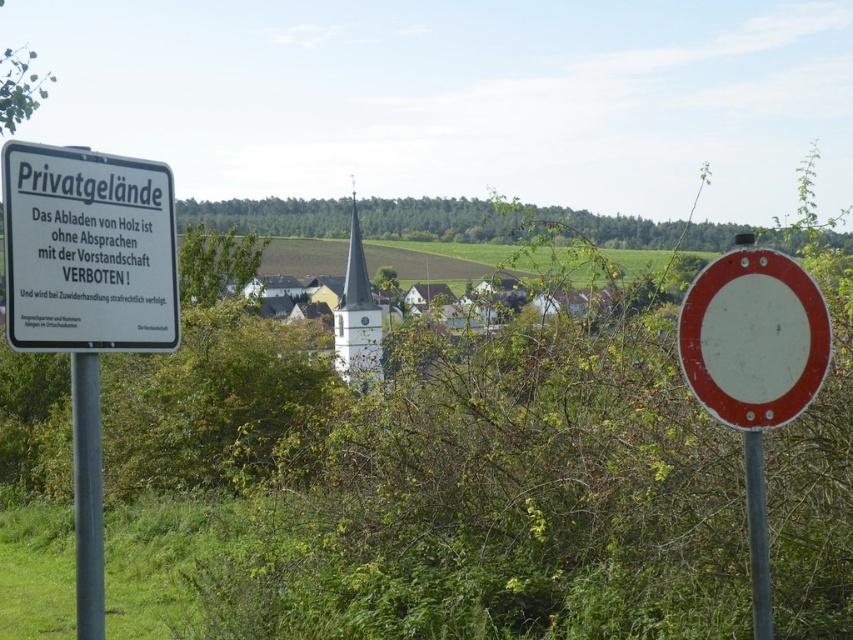
You are a delivery driver approaching the entrance of a property. You see a white plastic sign at upper left and a white matte circle at center. Which object is closer to you as you approach the entrance?

The white plastic sign at upper left is closer to you because it is in front of the white matte circle at center.

Consider the image. You are a delivery driver who needs to unload wood at this location. You see the white plastic sign at upper left and a camera. How far apart are they?

The white plastic sign at upper left and the camera are 18.78 feet apart.

You are a delivery driver who needs to pass through a narrow path between the white plastic sign at upper left and the white matte circle at center. Your truck is 8 feet wide. Can you safely navigate through the path without hitting either sign?

The distance between the white plastic sign at upper left and the white matte circle at center is 7.69 feet, which is narrower than the truck width of 8 feet. Therefore, the truck cannot safely pass through the path without risking a collision with one of the signs.